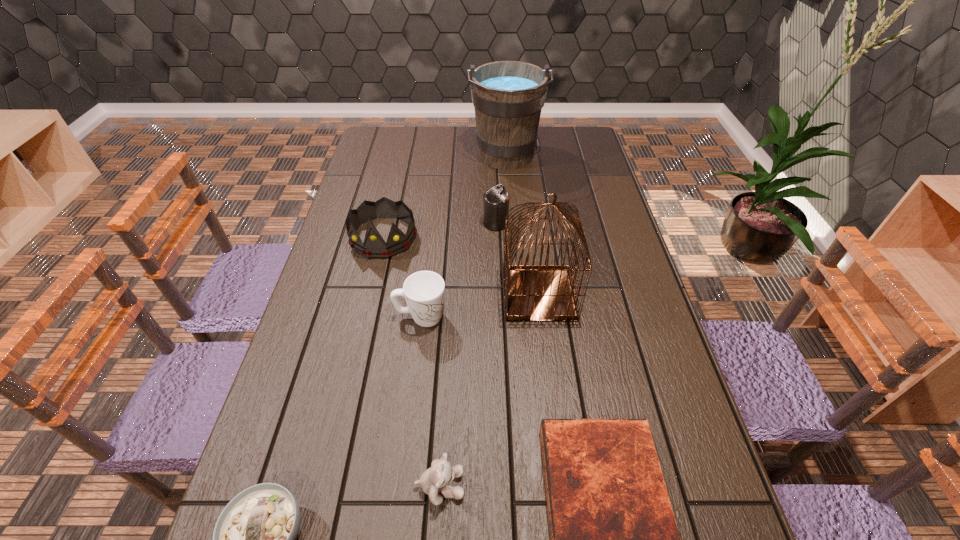
Image resolution: width=960 pixels, height=540 pixels. I want to click on vacant space located 0.070m on the side of the mug with the handle, so click(x=473, y=316).

Where is `free space located on the face of the teddy bear`? free space located on the face of the teddy bear is located at coordinates (562, 485).

The width and height of the screenshot is (960, 540). Identify the location of object at the far edge. (508, 96).

Where is `object present at the left edge`? object present at the left edge is located at coordinates (374, 246).

The height and width of the screenshot is (540, 960). Find the location of `vacant region at the far edge`. vacant region at the far edge is located at coordinates (551, 139).

Identify the location of vacant region at the left edge of the desktop. The image size is (960, 540). (357, 194).

Locate an element on the screen. The height and width of the screenshot is (540, 960). vacant space at the right edge of the desktop is located at coordinates (614, 389).

This screenshot has width=960, height=540. I want to click on unoccupied position between the mug and the teddy bear, so click(x=430, y=401).

Find the location of a particular element. The width and height of the screenshot is (960, 540). free space between the mug and the farthest object is located at coordinates (464, 237).

Identify which object is located as the fifth nearest to the farthest object. Please provide its 2D coordinates. Your answer should be formatted as a tuple, i.e. [(x, y)], where the tuple contains the x and y coordinates of a point satisfying the conditions above.

[(613, 536)]